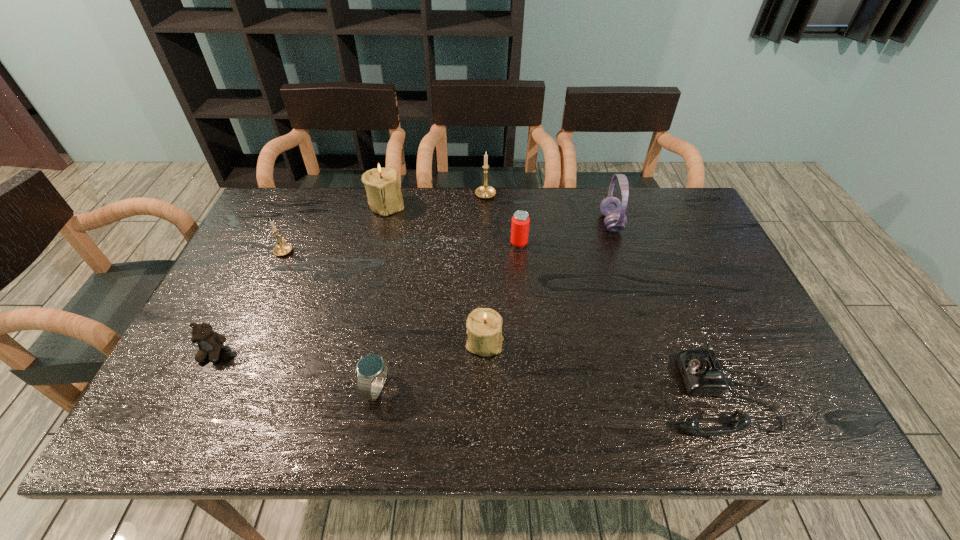
Locate an element on the screen. The image size is (960, 540). free point between the third candle_holder from right to left and the farther gold candle holder is located at coordinates (436, 200).

Find the location of a particular element. The height and width of the screenshot is (540, 960). free point between the red beer can and the left beige candle_holder is located at coordinates (453, 224).

This screenshot has height=540, width=960. In order to click on object that ranks as the closest to the blue watch in this screenshot , I will do `click(484, 325)`.

Identify which object is the second closest to the smaller beige candle_holder. Please provide its 2D coordinates. Your answer should be formatted as a tuple, i.e. [(x, y)], where the tuple contains the x and y coordinates of a point satisfying the conditions above.

[(520, 223)]

Select which candle_holder appears as the fourth closest to the watch. Please provide its 2D coordinates. Your answer should be formatted as a tuple, i.e. [(x, y)], where the tuple contains the x and y coordinates of a point satisfying the conditions above.

[(485, 191)]

I want to click on the third closest candle_holder to the left beige candle_holder, so click(x=484, y=325).

At what (x,y) coordinates should I click in order to perform the action: click on free space that satisfies the following two spatial constraints: 1. on the face of the teddy bear; 2. on the right side of the watch. Please return your answer as a coordinate pair (x, y). The height and width of the screenshot is (540, 960). Looking at the image, I should click on (196, 388).

The width and height of the screenshot is (960, 540). Identify the location of vacant area that satisfies the following two spatial constraints: 1. on the face of the brown teddy bear; 2. on the left side of the watch. (196, 388).

Where is `free space that satisfies the following two spatial constraints: 1. on the face of the blue watch; 2. on the left side of the brown teddy bear`? The image size is (960, 540). free space that satisfies the following two spatial constraints: 1. on the face of the blue watch; 2. on the left side of the brown teddy bear is located at coordinates (196, 388).